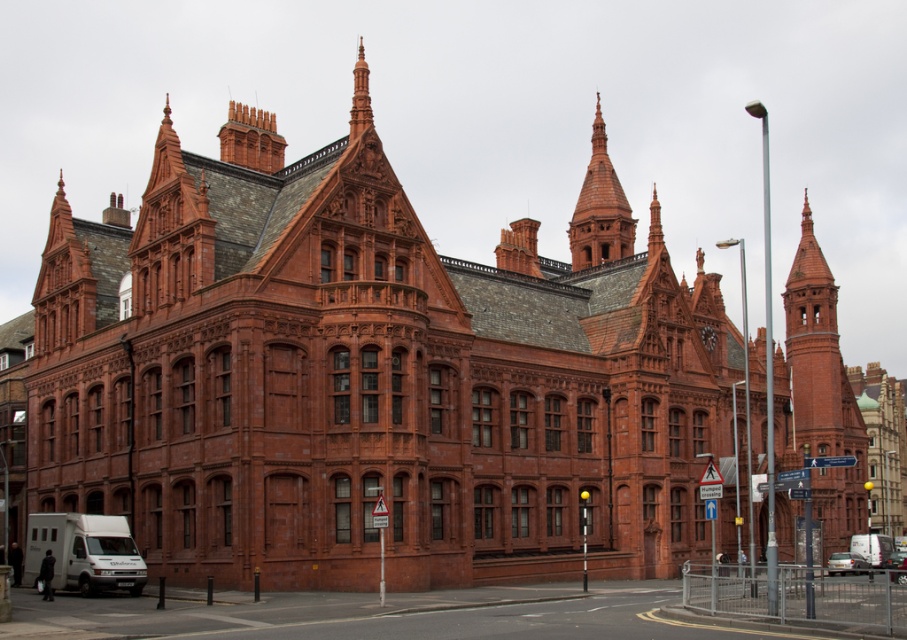
Question: Can you confirm if smooth terracotta tower at upper center is positioned to the left of metallic silver car at center?

Choices:
 (A) no
 (B) yes

Answer: (B)

Question: Which point is farther to the camera?

Choices:
 (A) (612, 250)
 (B) (891, 579)
 (C) (836, 332)
 (D) (358, 76)

Answer: (C)

Question: Which point is farther to the camera?

Choices:
 (A) (827, 413)
 (B) (856, 561)

Answer: (A)

Question: Which point is closer to the camera?

Choices:
 (A) (837, 356)
 (B) (352, 97)
 (C) (852, 560)
 (D) (584, 250)

Answer: (B)

Question: Is red brick tower at upper right wider than metallic silver car at center?

Choices:
 (A) no
 (B) yes

Answer: (B)

Question: Does smooth terracotta tower at upper center have a greater width compared to silver metallic car at lower right?

Choices:
 (A) no
 (B) yes

Answer: (A)